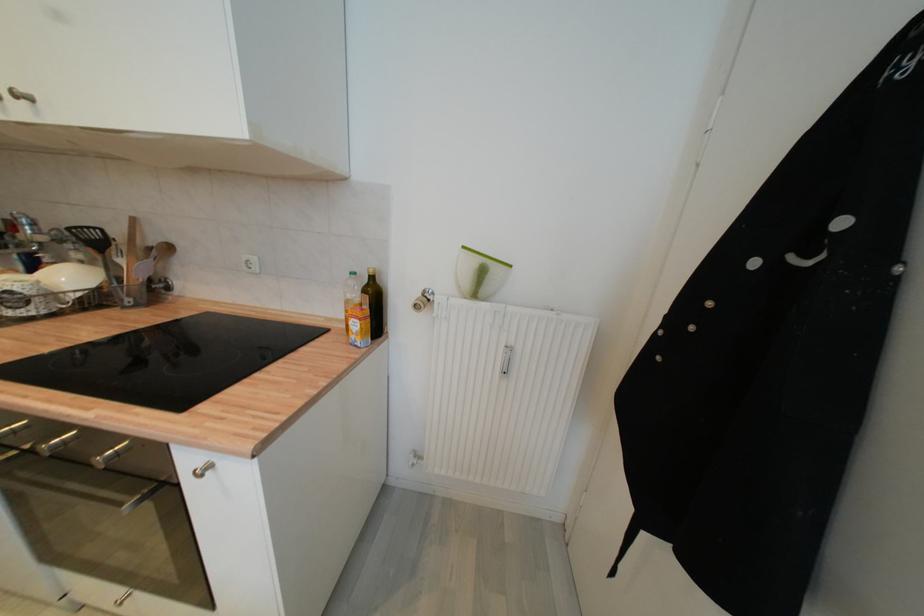
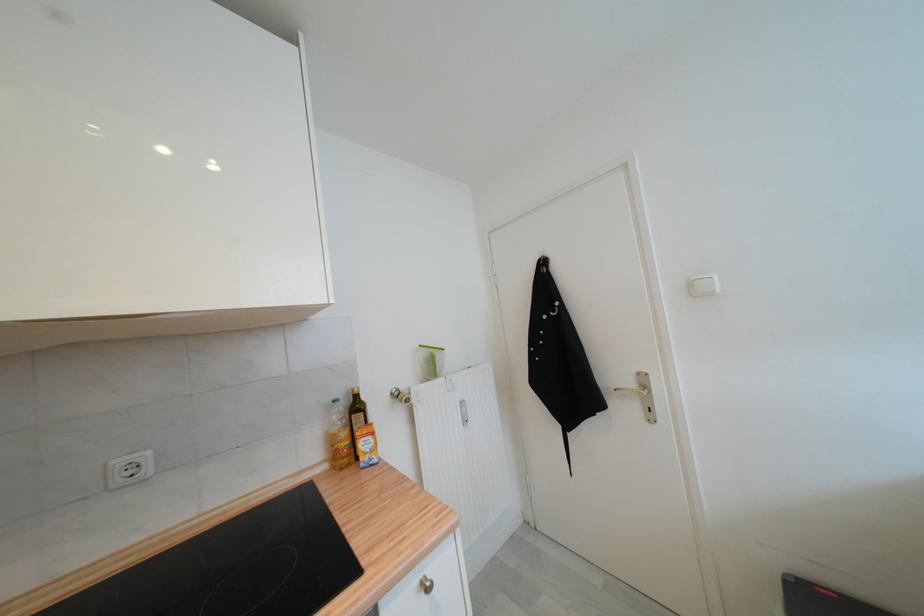
In the second image, find the point that corresponds to (x=250, y=259) in the first image.

(126, 464)